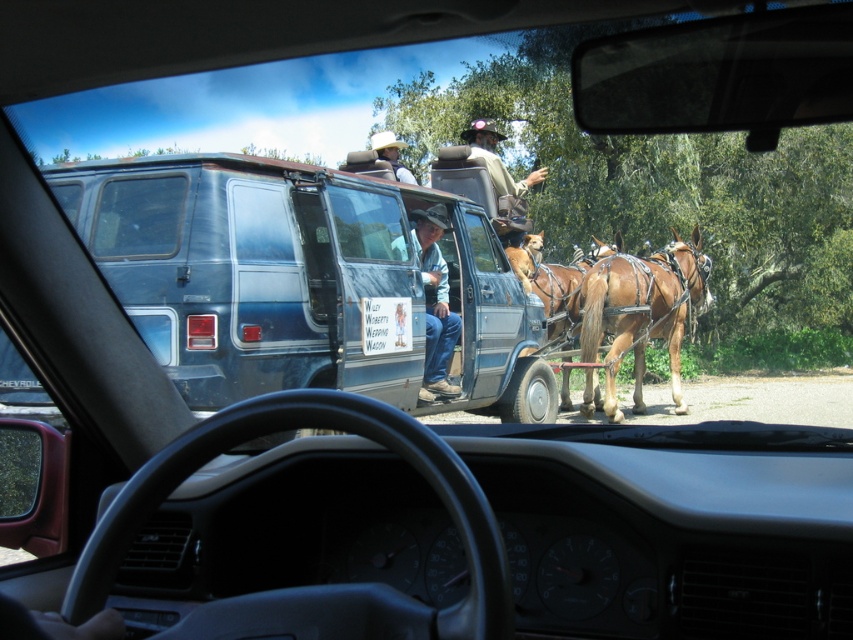
Which is above, brown glossy horse at right or matte white cowboy hat at upper center?

Positioned higher is matte white cowboy hat at upper center.

Is brown glossy horse at right below matte white cowboy hat at upper center?

Indeed, brown glossy horse at right is positioned under matte white cowboy hat at upper center.

Identify the location of brown glossy horse at right. This screenshot has width=853, height=640. (549, 284).

Find the location of `brown glossy horse at right`. brown glossy horse at right is located at coordinates (549, 284).

Between blue metallic van at center and blue jeans at center, which one is positioned lower?

blue metallic van at center

Is blue metallic van at center to the right of blue jeans at center from the viewer's perspective?

No, blue metallic van at center is not to the right of blue jeans at center.

Find the location of a particular element. blue metallic van at center is located at coordinates (300, 282).

Is brown glossy horse at center above brown glossy horse at right?

Actually, brown glossy horse at center is below brown glossy horse at right.

Is brown glossy horse at center bigger than brown glossy horse at right?

Correct, brown glossy horse at center is larger in size than brown glossy horse at right.

Between point (637, 394) and point (544, 284), which one is positioned in front?

Point (544, 284)

This screenshot has height=640, width=853. I want to click on brown glossy horse at center, so click(640, 314).